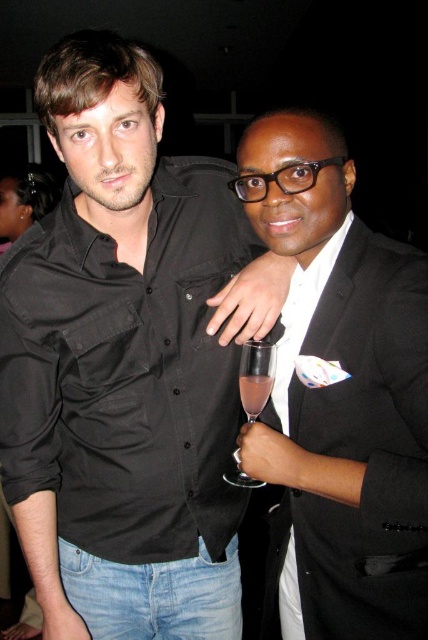
Question: Which point is farther to the camera?

Choices:
 (A) (273, 392)
 (B) (422, 451)
 (C) (256, 374)

Answer: (A)

Question: Based on their relative distances, which object is nearer to the clear glass wine glass at right?

Choices:
 (A) white satin shirt at right
 (B) black matte shirt at center
 (C) pink translucent liquid at center
 (D) black satin suit at right

Answer: (C)

Question: Can you confirm if clear glass wine glass at right is positioned to the left of pink translucent liquid at center?

Choices:
 (A) yes
 (B) no

Answer: (B)

Question: From the image, what is the correct spatial relationship of white satin shirt at right in relation to pink translucent liquid at center?

Choices:
 (A) left
 (B) right

Answer: (B)

Question: Which point is farther to the camera?

Choices:
 (A) black satin suit at right
 (B) white satin shirt at right

Answer: (B)

Question: Does black satin suit at right come in front of white satin shirt at right?

Choices:
 (A) no
 (B) yes

Answer: (B)